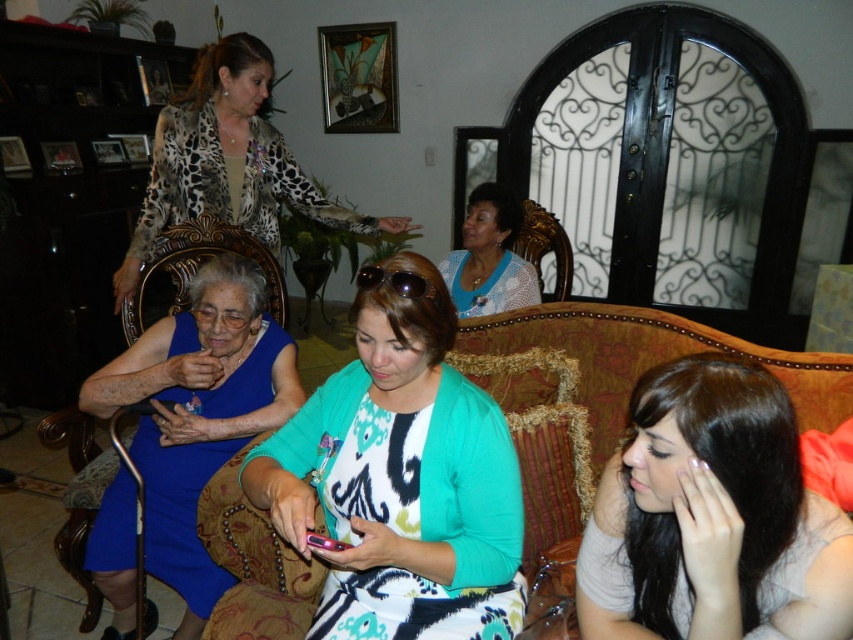
You are organizing a small event and need to place a decorative plate between the blue dotted blouse at center and the pink glossy smartphone at center. Which object should the plate be closer to if it needs to be centered between them?

The plate should be closer to the pink glossy smartphone at center because the blue dotted blouse at center is wider than the pink glossy smartphone at center, so the center point would be shifted towards the smaller object.

You are standing in the living room and want to take a photo of both point (167, 525) and point (186, 172) in the image. Which point should you focus on first to ensure both are in clear view?

Point (167, 525) is closer to the camera than point (186, 172). To ensure both are in clear view, focus on the closer point first, which is point (167, 525).

You are organizing a charity clothing drive and need to pack items into boxes. You have a box that can only fit items smaller than the leopard print jacket at upper left. Can the blue satin dress at lower left be placed in this box?

The blue satin dress at lower left is smaller than the leopard print jacket at upper left, so it can be placed in the box since it meets the size requirement.